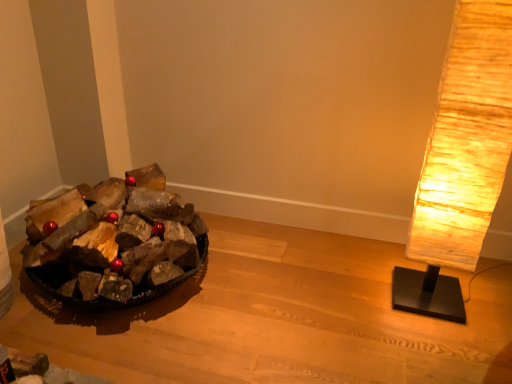
In order to click on vacant space to the right of dark brown wood at left in this screenshot , I will do `click(278, 287)`.